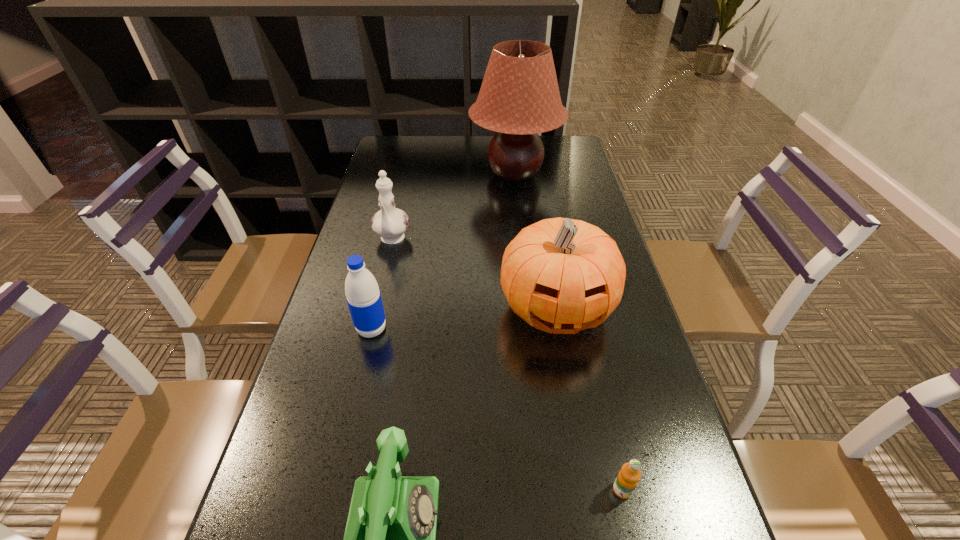
Identify the location of vacant position at the left edge of the desktop. The image size is (960, 540). (353, 392).

Identify the location of blank space at the right edge of the desktop. Image resolution: width=960 pixels, height=540 pixels. (626, 356).

Where is `vacant area at the far left corner`? vacant area at the far left corner is located at coordinates (411, 145).

The width and height of the screenshot is (960, 540). I want to click on vacant region between the chinaware and the pumpkin, so pos(474,274).

At what (x,y) coordinates should I click in order to perform the action: click on empty space between the second farthest object and the shortest object. Please return your answer as a coordinate pair (x, y). Image resolution: width=960 pixels, height=540 pixels. Looking at the image, I should click on (507, 365).

Find the location of a particular element. vacant area that lies between the shortest object and the fifth shortest object is located at coordinates (589, 399).

I want to click on free space between the orange juice and the second farthest object, so click(x=507, y=365).

Locate an element on the screen. The height and width of the screenshot is (540, 960). vacant region between the farthest object and the fifth nearest object is located at coordinates (453, 207).

Locate an element on the screen. vacant area that lies between the water bottle and the orange juice is located at coordinates (497, 409).

Where is `free spot between the fifth nearest object and the orange juice`? The height and width of the screenshot is (540, 960). free spot between the fifth nearest object and the orange juice is located at coordinates pyautogui.click(x=507, y=365).